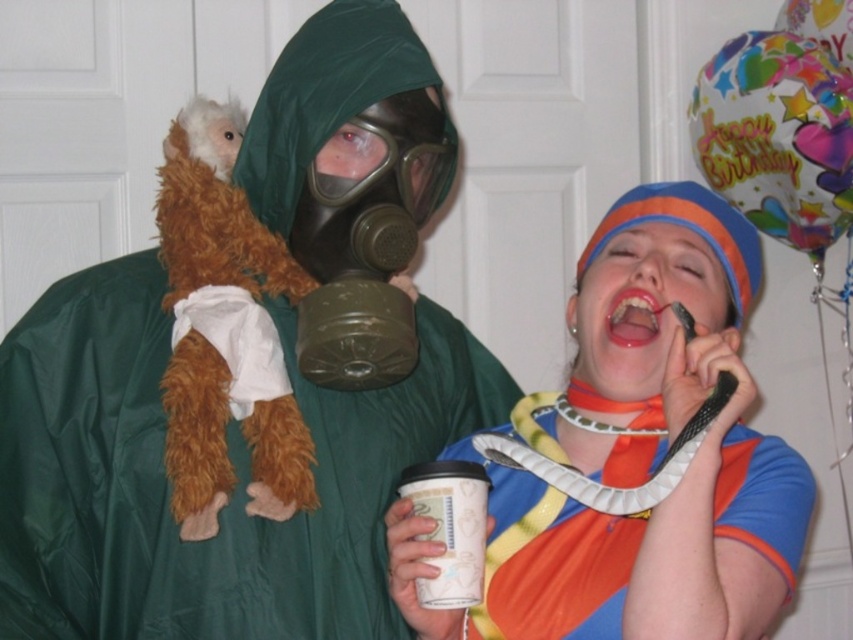
Between green matte raincoat at left and colorful paper balloon at upper right, which one appears on the left side from the viewer's perspective?

green matte raincoat at left is more to the left.

Which is behind, point (224, 368) or point (749, 212)?

The point (749, 212) is more distant.

Where is `green matte raincoat at left`? green matte raincoat at left is located at coordinates (233, 380).

Between colorful paper balloon at upper right and white paper cup at lower center, which one is positioned lower?

white paper cup at lower center

Does colorful paper balloon at upper right appear under white paper cup at lower center?

Incorrect, colorful paper balloon at upper right is not positioned below white paper cup at lower center.

Is point (804, 147) positioned in front of point (450, 547)?

No, it is behind (450, 547).

In order to click on colorful paper balloon at upper right in this screenshot , I will do `click(776, 134)`.

Which is above, matte plastic snake at right or colorful paper balloon at upper right?

colorful paper balloon at upper right

Does matte plastic snake at right appear on the left side of colorful paper balloon at upper right?

Indeed, matte plastic snake at right is positioned on the left side of colorful paper balloon at upper right.

Is point (601, 282) more distant than point (744, 104)?

No, (601, 282) is in front of (744, 104).

Locate an element on the screen. The width and height of the screenshot is (853, 640). matte plastic snake at right is located at coordinates click(x=648, y=448).